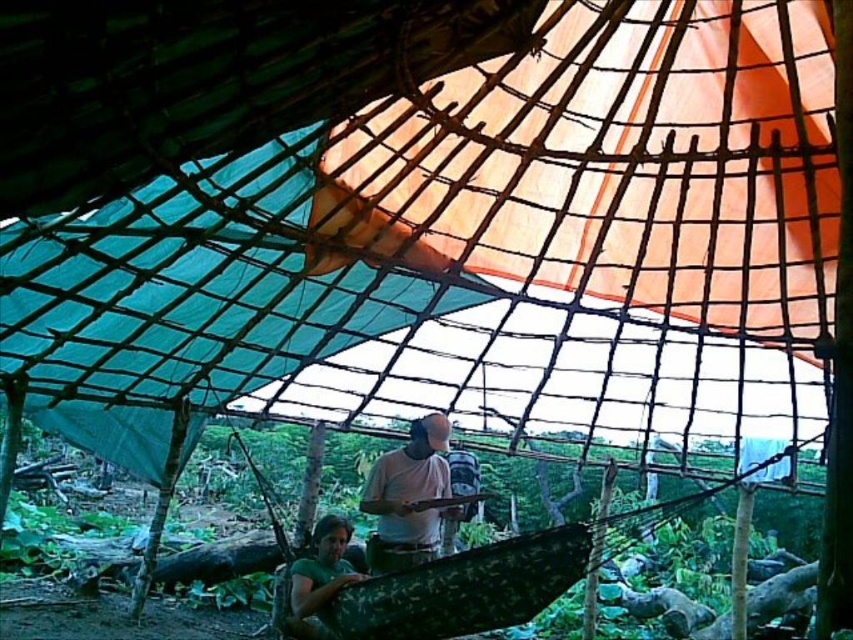
What is the object located at the coordinates point (408, 497) in the shelter?

The object located at point (408, 497) is the white cotton shirt at center.

You are standing inside the shelter and want to locate the white cotton shirt at center. According to the coordinates provided, where should you look?

You should look at point (408, 497) to find the white cotton shirt at center.